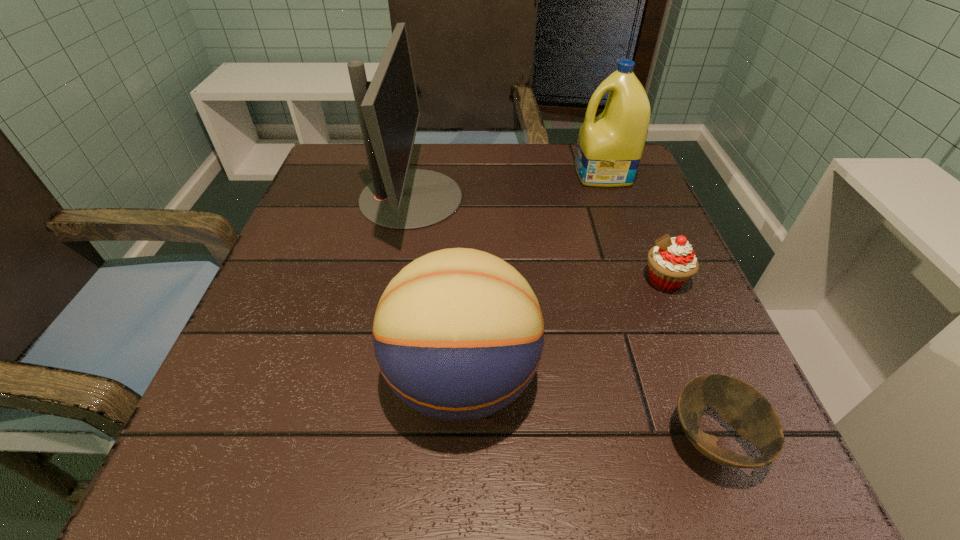
At what (x,y) coordinates should I click in order to perform the action: click on free space located 0.150m on the patterned surface of the basketball. Please return your answer as a coordinate pair (x, y). Looking at the image, I should click on (639, 379).

Image resolution: width=960 pixels, height=540 pixels. What are the coordinates of `vacant space located on the back of the second shortest object` in the screenshot? It's located at (648, 240).

At what (x,y) coordinates should I click in order to perform the action: click on vacant position located on the back of the bowl. Please return your answer as a coordinate pair (x, y). Image resolution: width=960 pixels, height=540 pixels. Looking at the image, I should click on (636, 238).

I want to click on computer monitor that is at the far edge, so click(x=399, y=198).

Locate an element on the screen. detergent positioned at the far edge is located at coordinates (609, 148).

Where is `basketball that is positioned at the near edge`? basketball that is positioned at the near edge is located at coordinates (458, 334).

The height and width of the screenshot is (540, 960). Find the location of `bowl at the near edge`. bowl at the near edge is located at coordinates (744, 408).

This screenshot has width=960, height=540. Identify the location of object at the left edge. (399, 198).

At what (x,y) coordinates should I click in order to perform the action: click on detergent that is at the right edge. Please return your answer as a coordinate pair (x, y). The image size is (960, 540). Looking at the image, I should click on (609, 148).

The image size is (960, 540). I want to click on cupcake located at the right edge, so click(672, 262).